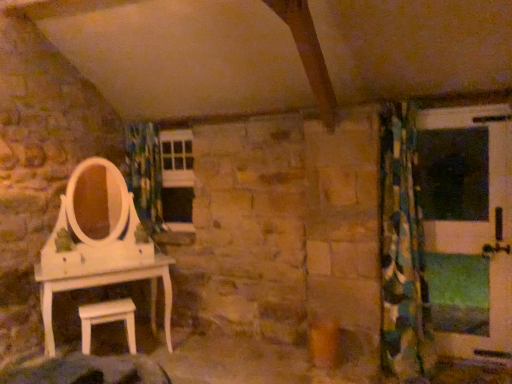
Question: Are white matte stool at lower left and green matte screen door at right far apart?

Choices:
 (A) yes
 (B) no

Answer: (A)

Question: From a real-world perspective, does white matte stool at lower left stand above green matte screen door at right?

Choices:
 (A) no
 (B) yes

Answer: (A)

Question: Does white matte stool at lower left have a larger size compared to green matte screen door at right?

Choices:
 (A) yes
 (B) no

Answer: (B)

Question: Is white matte stool at lower left closer to camera compared to green matte screen door at right?

Choices:
 (A) no
 (B) yes

Answer: (B)

Question: Is the surface of white matte stool at lower left in direct contact with green matte screen door at right?

Choices:
 (A) yes
 (B) no

Answer: (B)

Question: From the image's perspective, is white matte stool at lower left below green matte screen door at right?

Choices:
 (A) no
 (B) yes

Answer: (B)

Question: Is green matte screen door at right in contact with green and blue patterned curtain at right?

Choices:
 (A) yes
 (B) no

Answer: (B)

Question: From a real-world perspective, is green matte screen door at right under green and blue patterned curtain at right?

Choices:
 (A) no
 (B) yes

Answer: (B)

Question: Does green matte screen door at right appear on the left side of green and blue patterned curtain at right?

Choices:
 (A) yes
 (B) no

Answer: (B)

Question: Considering the relative sizes of green matte screen door at right and green and blue patterned curtain at right in the image provided, is green matte screen door at right smaller than green and blue patterned curtain at right?

Choices:
 (A) no
 (B) yes

Answer: (B)

Question: Is green matte screen door at right positioned beyond the bounds of green and blue patterned curtain at right?

Choices:
 (A) yes
 (B) no

Answer: (A)

Question: Is green matte screen door at right not near green and blue patterned curtain at right?

Choices:
 (A) no
 (B) yes

Answer: (A)

Question: Is white matte stool at lower left completely or partially outside of blue-green patterned fabric at center?

Choices:
 (A) no
 (B) yes

Answer: (B)